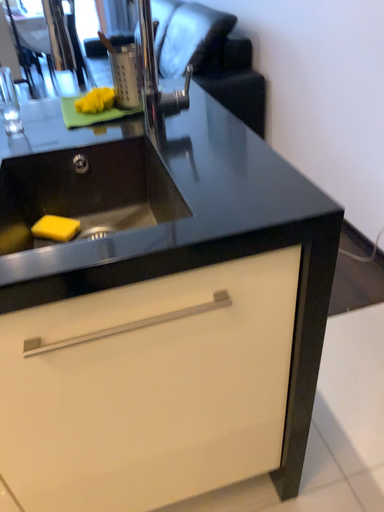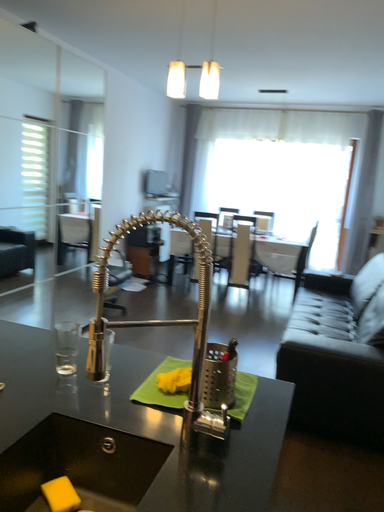
Question: How did the camera likely rotate when shooting the video?

Choices:
 (A) rotated upward
 (B) rotated downward

Answer: (A)